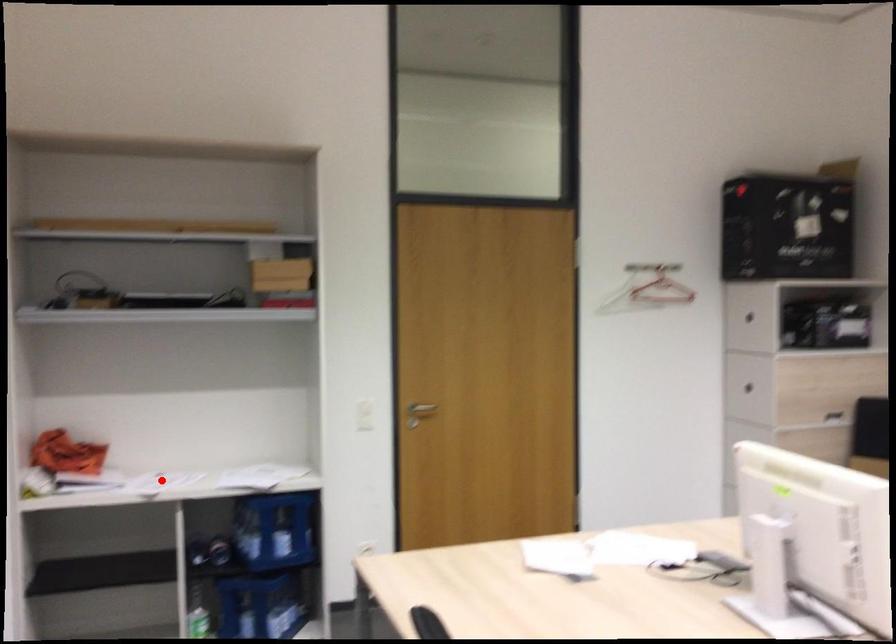
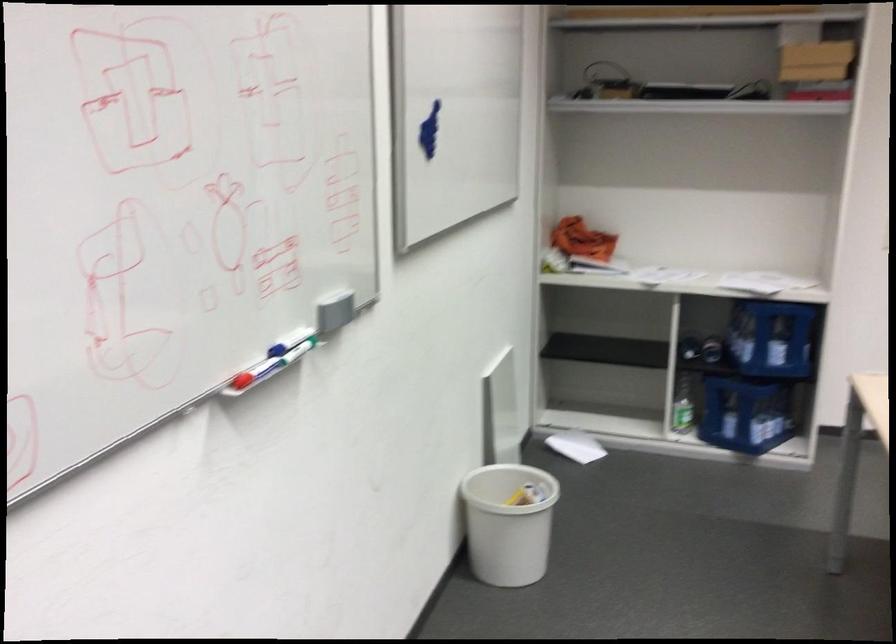
In the second image, find the point that corresponds to the highlighted location in the first image.

(660, 275)